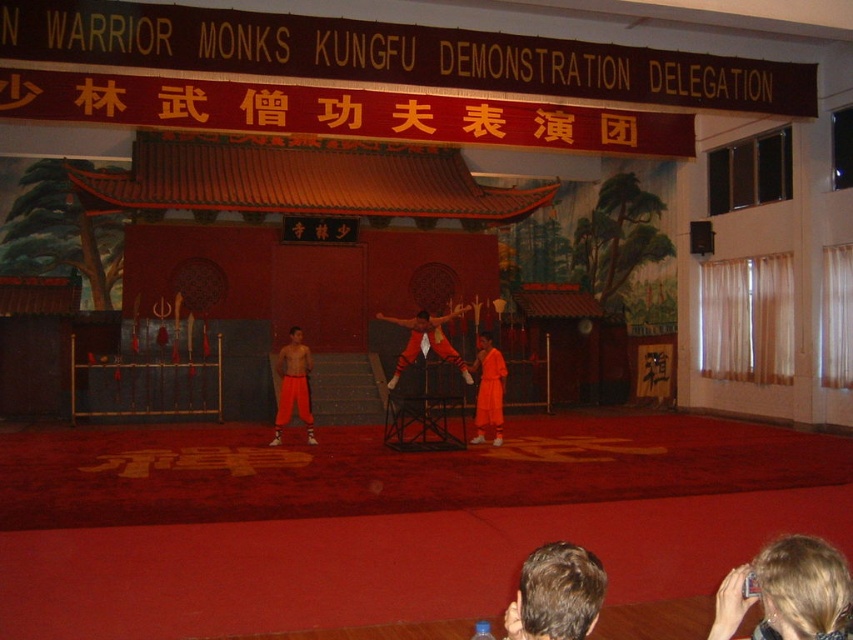
Is brown hair at lower center to the right of orange cloth at center from the viewer's perspective?

No, brown hair at lower center is not to the right of orange cloth at center.

Which is in front, point (572, 589) or point (479, 356)?

Point (572, 589) is more forward.

Which is in front, point (503, 618) or point (502, 417)?

Point (503, 618) is more forward.

The width and height of the screenshot is (853, 640). Find the location of `brown hair at lower center`. brown hair at lower center is located at coordinates (556, 593).

Is brown hair at lower center positioned behind matte red pants at center?

No, brown hair at lower center is in front of matte red pants at center.

Which is below, brown hair at lower center or matte red pants at center?

Positioned lower is brown hair at lower center.

Which is behind, point (566, 586) or point (434, 352)?

The point (434, 352) is more distant.

The height and width of the screenshot is (640, 853). In order to click on brown hair at lower center in this screenshot , I will do `click(556, 593)`.

Which is in front, point (421, 321) or point (489, 339)?

Positioned in front is point (489, 339).

Which is behind, point (459, 358) or point (494, 358)?

The point (459, 358) is behind.

Locate an element on the screen. The image size is (853, 640). matte red pants at center is located at coordinates pos(426,340).